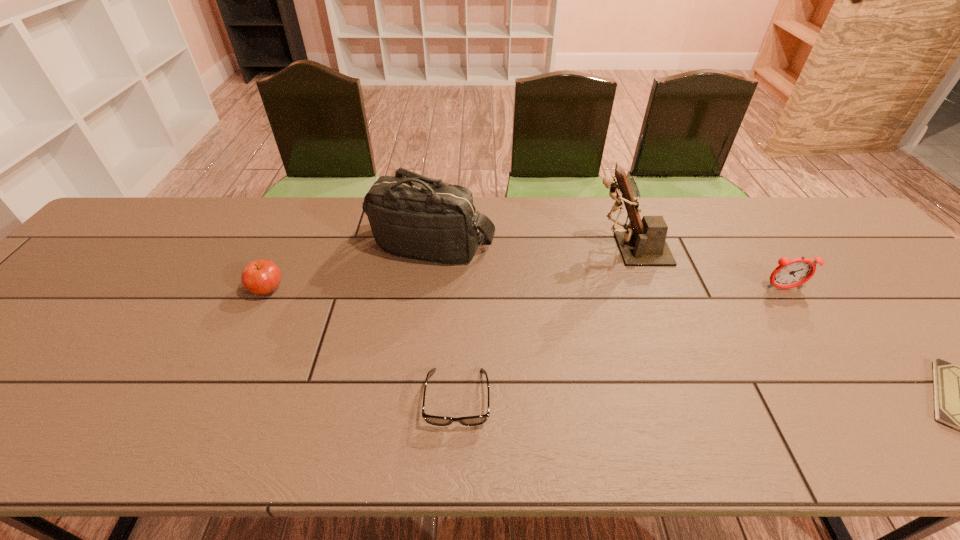
This screenshot has height=540, width=960. Find the location of `vacant space located at the front padded panel of the shoulder bag`. vacant space located at the front padded panel of the shoulder bag is located at coordinates (423, 316).

Locate an element on the screen. The height and width of the screenshot is (540, 960). vacant position located on the front-facing side of the alarm clock is located at coordinates (804, 319).

This screenshot has height=540, width=960. What are the coordinates of `free space located 0.350m on the front of the leftmost object` in the screenshot? It's located at (198, 436).

At what (x,y) coordinates should I click in order to perform the action: click on figurine at the far edge. Please return your answer as a coordinate pair (x, y). Looking at the image, I should click on (643, 242).

I want to click on shoulder bag that is at the far edge, so click(412, 216).

Where is `object located at the near edge`? Image resolution: width=960 pixels, height=540 pixels. object located at the near edge is located at coordinates (430, 419).

At what (x,y) coordinates should I click in order to perform the action: click on vacant space at the far edge of the desktop. Please return your answer as a coordinate pair (x, y). The height and width of the screenshot is (540, 960). Looking at the image, I should click on (668, 239).

In the image, there is a desktop. Identify the location of free space at the near edge. The image size is (960, 540). (148, 418).

I want to click on free location at the right edge, so click(x=883, y=273).

You are a GUI agent. You are given a task and a screenshot of the screen. Output one action in this format:
    pyautogui.click(x=<x>, y=<y>)
    Task: Click on the vacant space at the far left corner of the desktop
    The width and height of the screenshot is (960, 540).
    Given the screenshot: What is the action you would take?
    pyautogui.click(x=157, y=206)